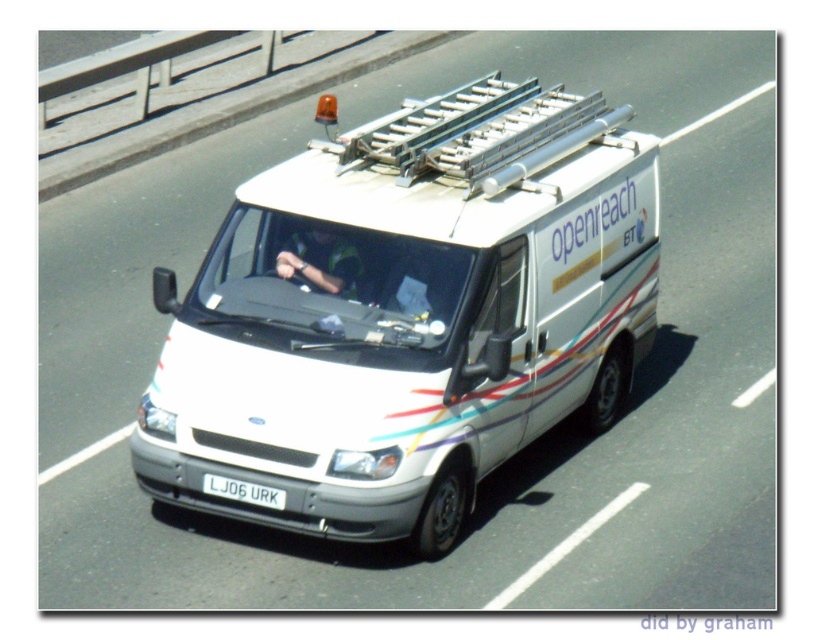
Which is more to the right, green fabric shirt at center or white plastic license plate at center?

green fabric shirt at center

Which is in front, point (335, 291) or point (282, 500)?

Positioned in front is point (282, 500).

Which is in front, point (317, 250) or point (222, 481)?

Positioned in front is point (222, 481).

Identify the location of green fabric shirt at center. The image size is (814, 640). (322, 262).

Looking at this image, between white matte van at center and white plastic license plate at center, which one is positioned lower?

white plastic license plate at center is below.

Can you confirm if white matte van at center is smaller than white plastic license plate at center?

No, white matte van at center is not smaller than white plastic license plate at center.

Between point (173, 376) and point (248, 486), which one is positioned in front?

Point (248, 486) is in front.

The width and height of the screenshot is (814, 640). Identify the location of white matte van at center. (410, 314).

Describe the element at coordinates (410, 314) in the screenshot. I see `white matte van at center` at that location.

Which of these two, white matte van at center or green fabric shirt at center, stands taller?

With more height is white matte van at center.

Is point (581, 198) in front of point (339, 240)?

No.

The width and height of the screenshot is (814, 640). I want to click on white matte van at center, so click(x=410, y=314).